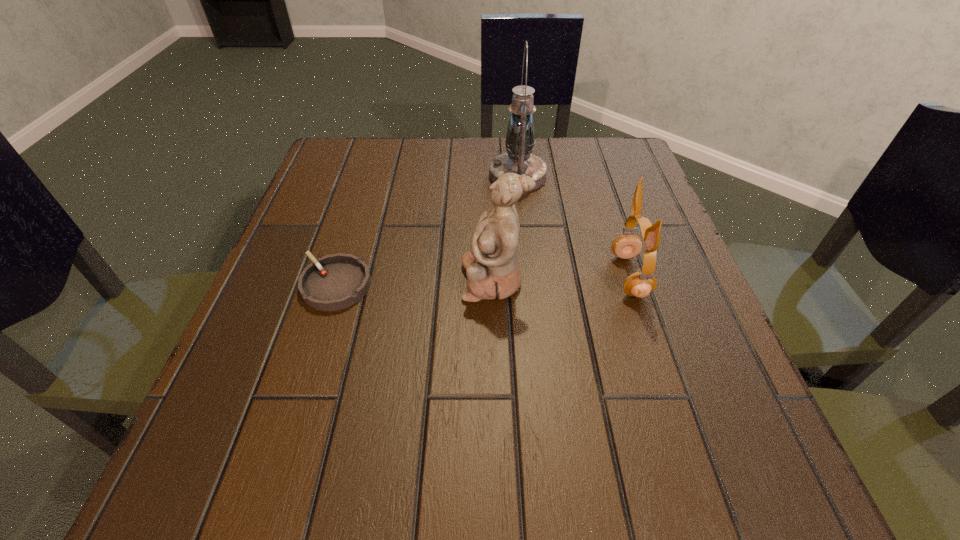
This screenshot has height=540, width=960. In order to click on free space located on the front-facing side of the figurine in this screenshot , I will do `click(403, 280)`.

Find the location of a particular element. free space located 0.080m on the front-facing side of the earphone is located at coordinates (568, 276).

Image resolution: width=960 pixels, height=540 pixels. Find the location of `vacant space located on the front-facing side of the earphone`. vacant space located on the front-facing side of the earphone is located at coordinates (460, 276).

This screenshot has height=540, width=960. Identify the location of vacant space located on the front-facing side of the earphone. (425, 276).

This screenshot has height=540, width=960. Find the location of `free space located on the back of the shortest object`. free space located on the back of the shortest object is located at coordinates (377, 152).

Locate an element on the screen. Image resolution: width=960 pixels, height=540 pixels. object at the far edge is located at coordinates (519, 159).

Where is `object located in the left edge section of the desktop`? The width and height of the screenshot is (960, 540). object located in the left edge section of the desktop is located at coordinates (334, 282).

Locate an element on the screen. object located in the right edge section of the desktop is located at coordinates (640, 284).

Identify the location of free region at the far edge of the desktop. This screenshot has width=960, height=540. (420, 176).

In the image, there is a desktop. Where is `vacant area at the near edge`? vacant area at the near edge is located at coordinates (403, 493).